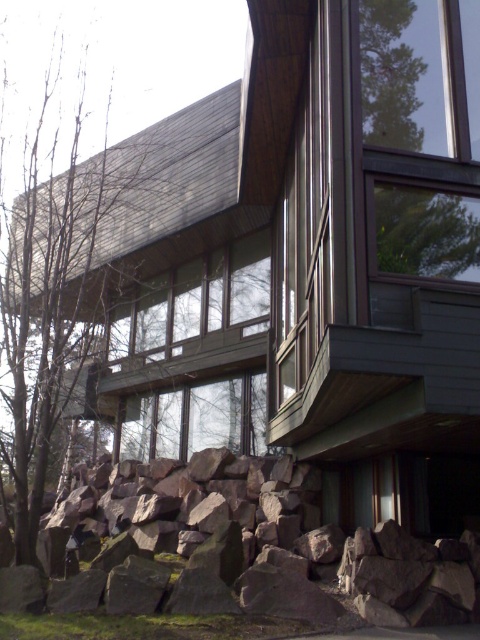
What do you see at coordinates (264, 557) in the screenshot? I see `brown rough rock at lower left` at bounding box center [264, 557].

Which is in front, point (412, 552) or point (39, 221)?

Point (412, 552)

Where is `brown rough rock at lower left`? brown rough rock at lower left is located at coordinates (264, 557).